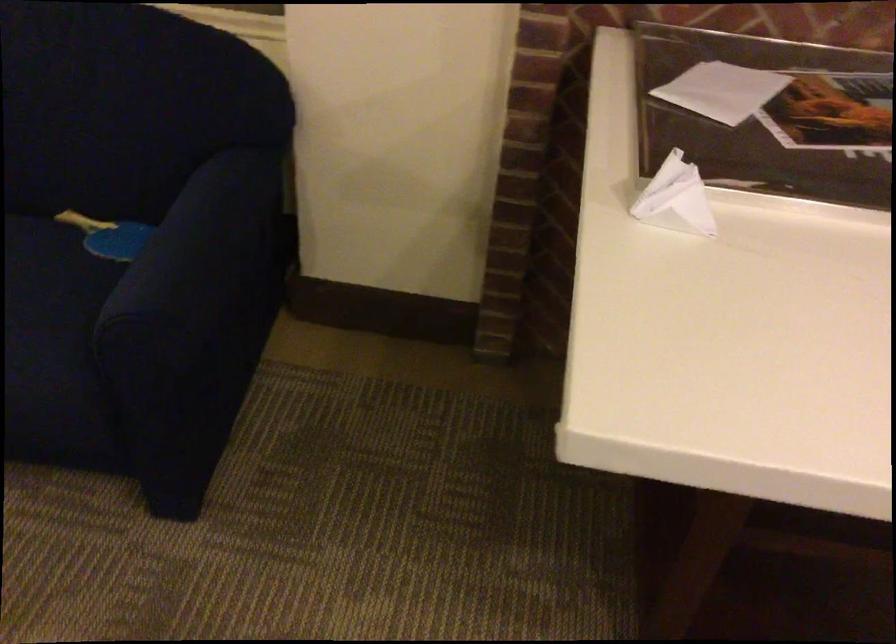
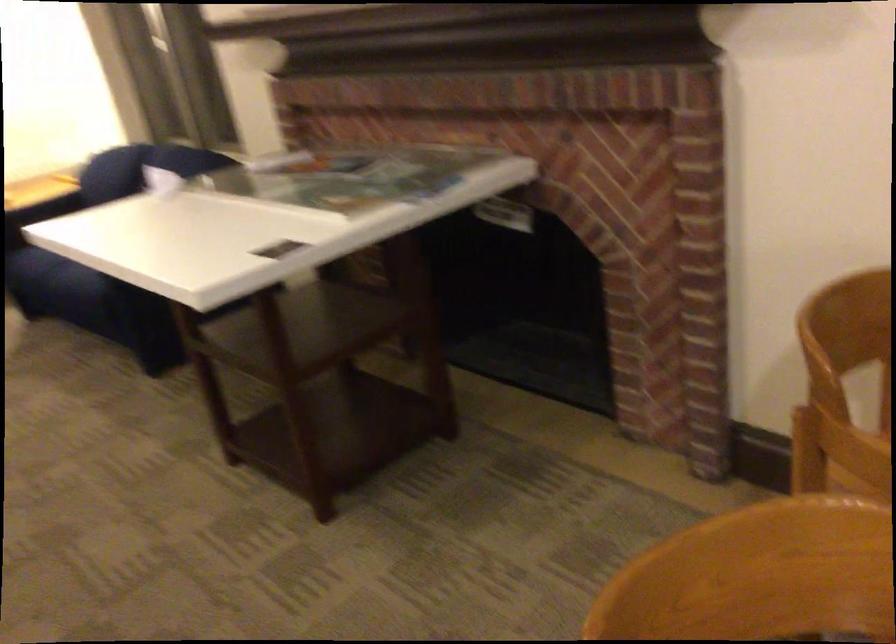
Question: I am providing you with two images of the same scene from different viewpoints. Please identify which objects are invisible in image2.

Choices:
 (A) blue sofa armrest
 (B) sofa armrest
 (C) sofa sitting surface
 (D) splatter guard handle

Answer: (A)